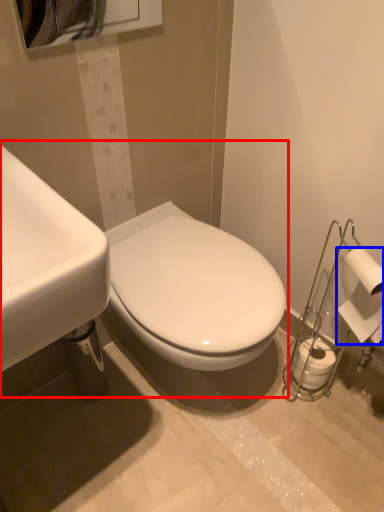
Question: Which object appears closest to the camera in this image, sink (highlighted by a red box) or toilet paper (highlighted by a blue box)?

Choices:
 (A) sink
 (B) toilet paper

Answer: (A)